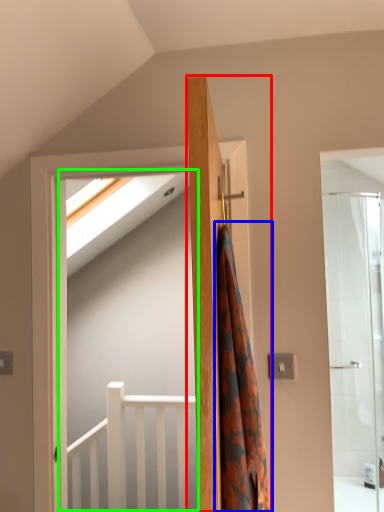
Question: Which object is positioned closest to door (highlighted by a red box)? Select from shower curtain (highlighted by a blue box) and screen door (highlighted by a green box).

Choices:
 (A) shower curtain
 (B) screen door

Answer: (A)